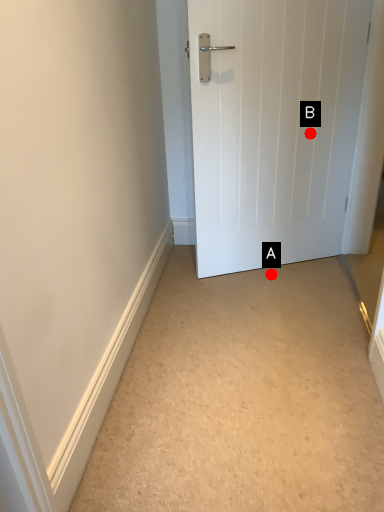
Question: Two points are circled on the image, labeled by A and B beside each circle. Which point is farther from the camera taking this photo?

Choices:
 (A) A is further
 (B) B is further

Answer: (A)